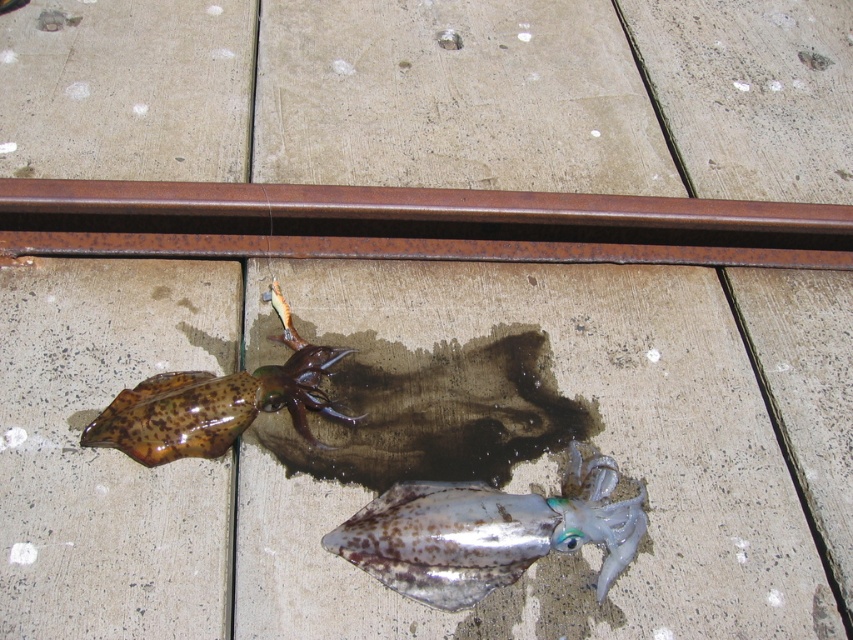
You are a delivery robot with a 18 inch wide package. You need to move from the edge of the wooden deck to the delivery point near the rusty metal rail at center. There is a speckled translucent squid at center in the way. Can you navigate around the squid while keeping the package intact?

The distance between the rusty metal rail at center and the speckled translucent squid at center is 20.58 inches. Since your package is 18 inches wide, you can navigate around the squid by moving either side, as there is enough space between them to maneuver safely without damaging the package.

You are a painter standing on the wooden deck. You need to paint the rusty metal rail at center and the brown glossy squid at upper left. Which object requires more paint because it has a larger surface area?

The rusty metal rail at center requires more paint because it has a larger surface area than the brown glossy squid at upper left.

You are a marine biologist examining two squids on a wooden deck. The speckled translucent squid at center and the brown glossy squid at upper left are both present. Which squid has a greater width?

The speckled translucent squid at center has a greater width than the brown glossy squid at upper left.